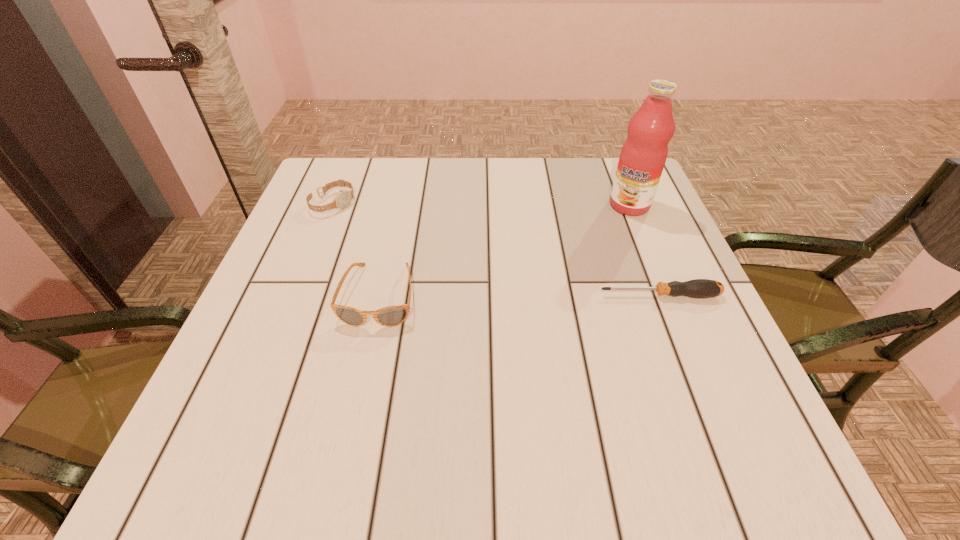
Where is `free space located on the face of the leftmost object`? The height and width of the screenshot is (540, 960). free space located on the face of the leftmost object is located at coordinates 422,252.

Where is `fruit juice located in the far edge section of the desktop`? This screenshot has width=960, height=540. fruit juice located in the far edge section of the desktop is located at coordinates (643, 155).

Where is `watch at the far edge`? The image size is (960, 540). watch at the far edge is located at coordinates (343, 198).

The image size is (960, 540). What are the coordinates of `object situated at the left edge` in the screenshot? It's located at (343, 198).

Identify the location of screwdriver at the right edge. (698, 288).

Identify the location of fruit juice that is at the right edge. This screenshot has width=960, height=540. (643, 155).

This screenshot has height=540, width=960. Identify the location of object located in the far left corner section of the desktop. (343, 198).

The height and width of the screenshot is (540, 960). In order to click on object present at the far right corner in this screenshot , I will do `click(643, 155)`.

Find the location of a particular element. This screenshot has height=540, width=960. vacant space at the far edge of the desktop is located at coordinates (542, 192).

The width and height of the screenshot is (960, 540). Find the location of `free point at the near edge`. free point at the near edge is located at coordinates (613, 414).